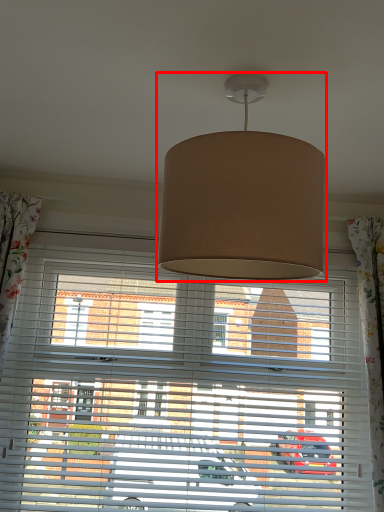
Question: From the image's perspective, what is the correct spatial positioning of lamp (annotated by the red box) in reference to window blind?

Choices:
 (A) above
 (B) below

Answer: (A)